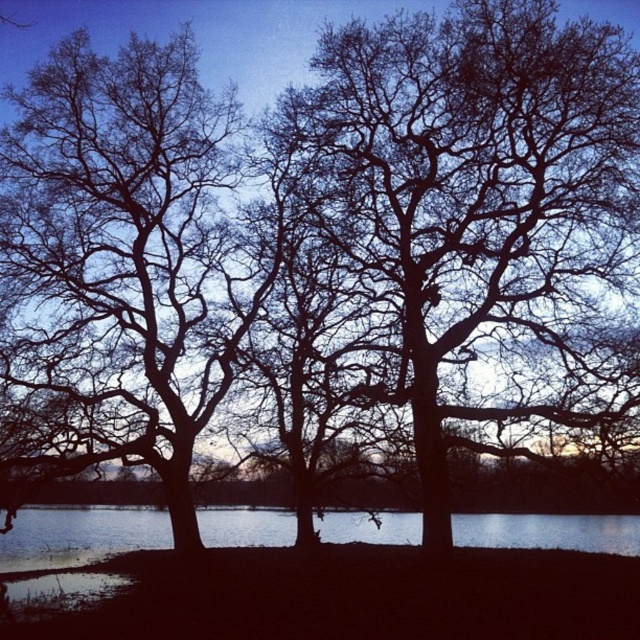
Which is more to the right, bare branches at left or clear water at center?

Positioned to the right is clear water at center.

Is point (234, 346) less distant than point (605, 552)?

No, (234, 346) is further to viewer.

The width and height of the screenshot is (640, 640). In order to click on bare branches at left in this screenshot , I will do `click(125, 257)`.